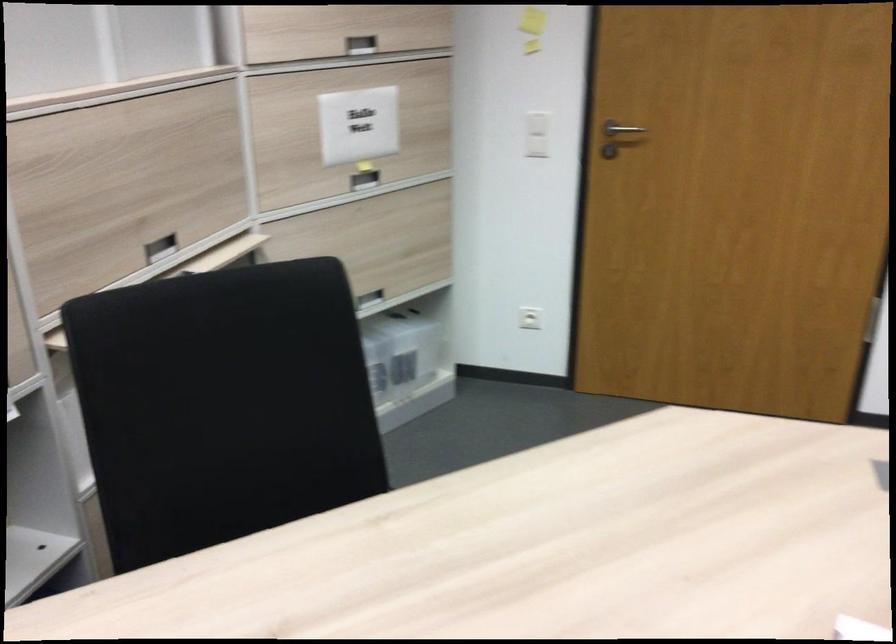
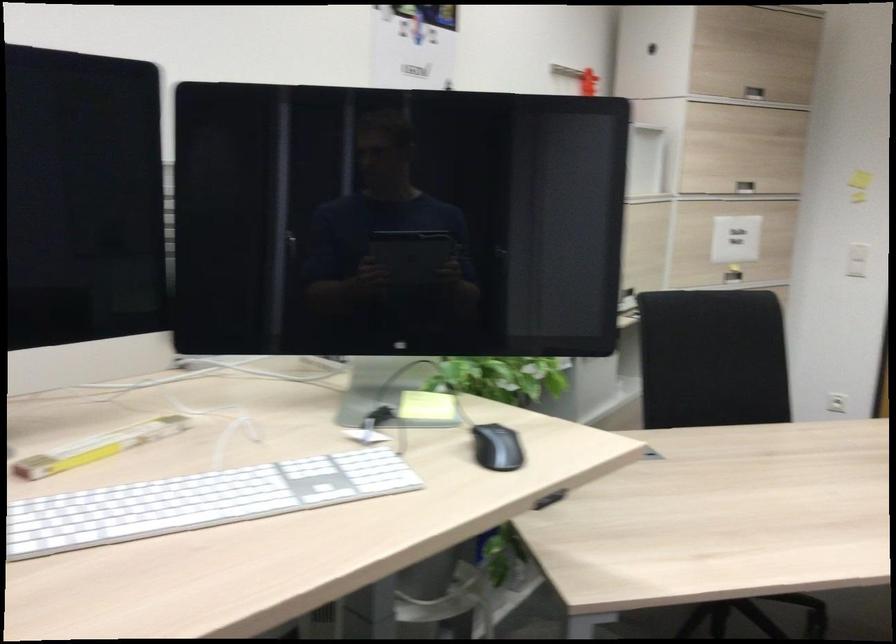
Question: I am providing you with two images of the same scene from different viewpoints. After the viewpoint changes to image2, which objects are now occluded?

Choices:
 (A) plastic storage box
 (B) yellow game box
 (C) black computer mouse
 (D) white computer keyboard

Answer: (A)